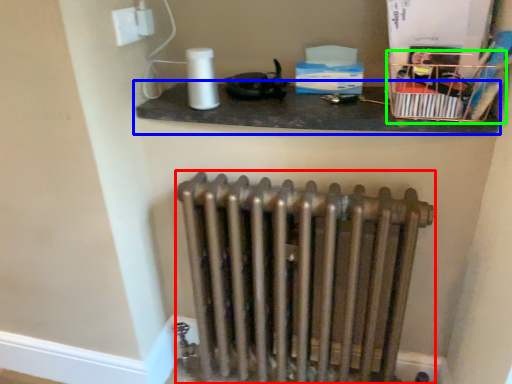
Question: Which object is positioned closest to radiator (highlighted by a red box)? Select from shelf (highlighted by a blue box) and crate (highlighted by a green box).

Choices:
 (A) shelf
 (B) crate

Answer: (A)